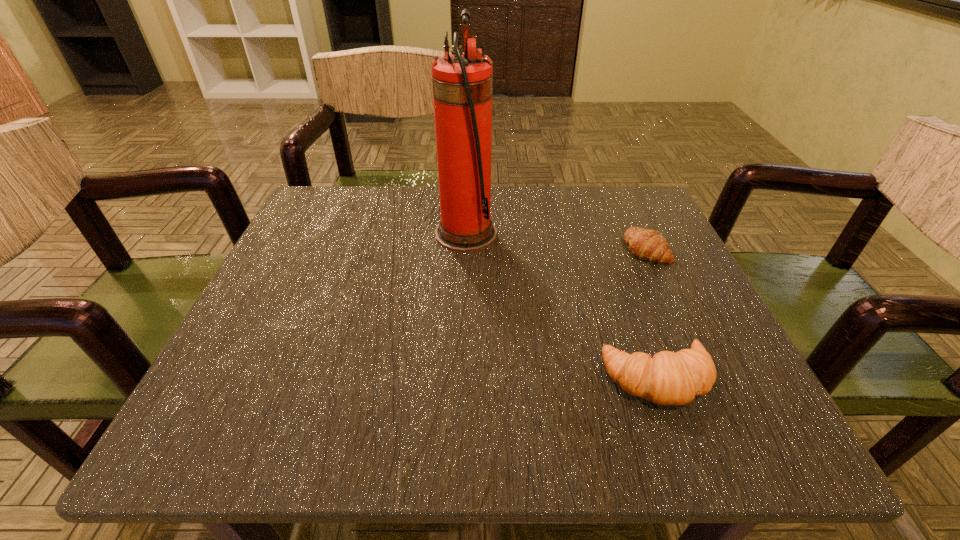
Where is `blank area in the image that satisfies the following two spatial constraints: 1. at the discharge end of the tallest object; 2. on the right side of the taller crescent roll`? This screenshot has width=960, height=540. blank area in the image that satisfies the following two spatial constraints: 1. at the discharge end of the tallest object; 2. on the right side of the taller crescent roll is located at coordinates pos(460,379).